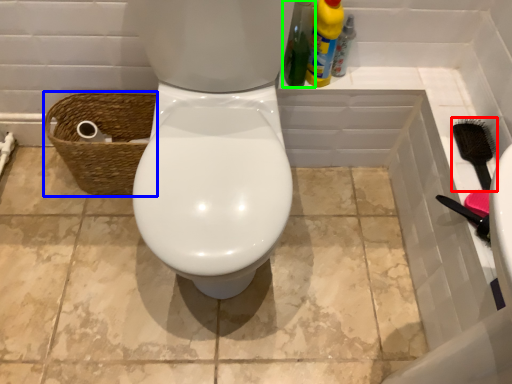
Question: Estimate the real-world distances between objects in this image. Which object is farther from brush (highlighted by a red box), basket (highlighted by a blue box) or cleaning product (highlighted by a green box)?

Choices:
 (A) basket
 (B) cleaning product

Answer: (A)